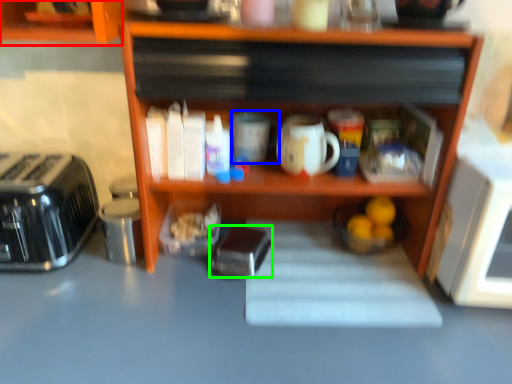
Question: Considering the real-world distances, which object is closest to cabinetry (highlighted by a red box)? mug (highlighted by a blue box) or appliance (highlighted by a green box).

Choices:
 (A) mug
 (B) appliance

Answer: (A)